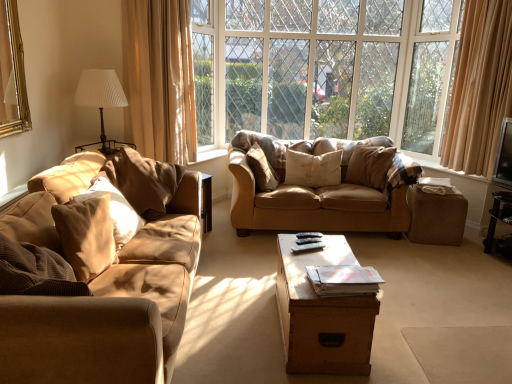
You are a GUI agent. You are given a task and a screenshot of the screen. Output one action in this format:
    pyautogui.click(x=<x>, y=<y>)
    Task: Click on the free space above wooden trunk at center (from a real-world perspective)
    
    Given the screenshot: What is the action you would take?
    tap(314, 255)